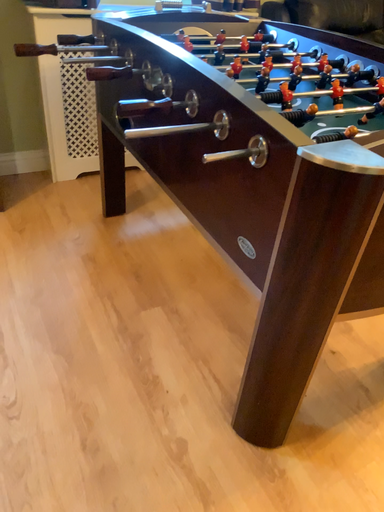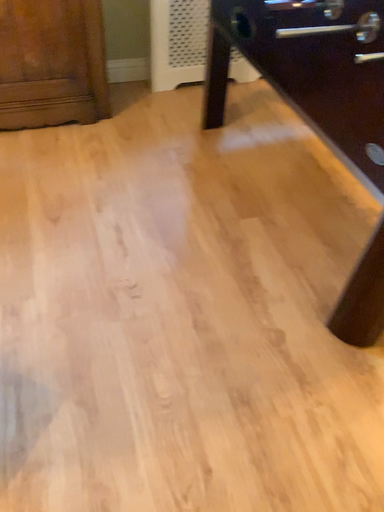
Question: How did the camera likely rotate when shooting the video?

Choices:
 (A) rotated left
 (B) rotated right

Answer: (A)